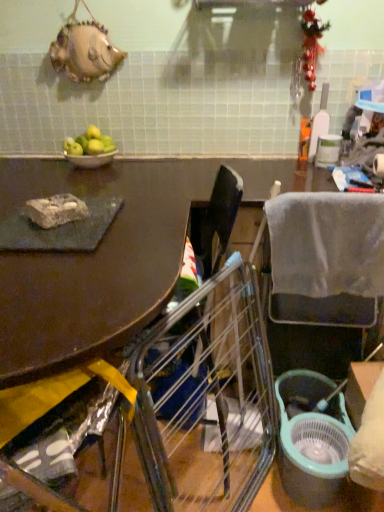
Question: Are green matte apples at upper left and rocky stone at left beside each other?

Choices:
 (A) no
 (B) yes

Answer: (A)

Question: Is green matte apples at upper left oriented away from rocky stone at left?

Choices:
 (A) yes
 (B) no

Answer: (B)

Question: Does green matte apples at upper left have a lesser height compared to rocky stone at left?

Choices:
 (A) yes
 (B) no

Answer: (B)

Question: From the image's perspective, would you say green matte apples at upper left is positioned over rocky stone at left?

Choices:
 (A) yes
 (B) no

Answer: (A)

Question: Does green matte apples at upper left appear on the left side of rocky stone at left?

Choices:
 (A) yes
 (B) no

Answer: (A)

Question: From a real-world perspective, is green matte apples at upper left physically above rocky stone at left?

Choices:
 (A) yes
 (B) no

Answer: (A)

Question: Does metallic silver bowl at upper left come behind green matte apples at upper left?

Choices:
 (A) yes
 (B) no

Answer: (A)

Question: Can you confirm if metallic silver bowl at upper left is positioned to the right of green matte apples at upper left?

Choices:
 (A) no
 (B) yes

Answer: (B)

Question: Considering the relative sizes of metallic silver bowl at upper left and green matte apples at upper left in the image provided, is metallic silver bowl at upper left bigger than green matte apples at upper left?

Choices:
 (A) no
 (B) yes

Answer: (A)

Question: Is metallic silver bowl at upper left positioned with its back to green matte apples at upper left?

Choices:
 (A) no
 (B) yes

Answer: (A)

Question: Considering the relative sizes of metallic silver bowl at upper left and green matte apples at upper left in the image provided, is metallic silver bowl at upper left wider than green matte apples at upper left?

Choices:
 (A) no
 (B) yes

Answer: (B)

Question: From a real-world perspective, is metallic silver bowl at upper left located beneath green matte apples at upper left?

Choices:
 (A) yes
 (B) no

Answer: (A)

Question: Is metallic silver chair at lower left, arranged as the 2th chair when viewed from the back, facing away from rocky stone at left?

Choices:
 (A) no
 (B) yes

Answer: (A)